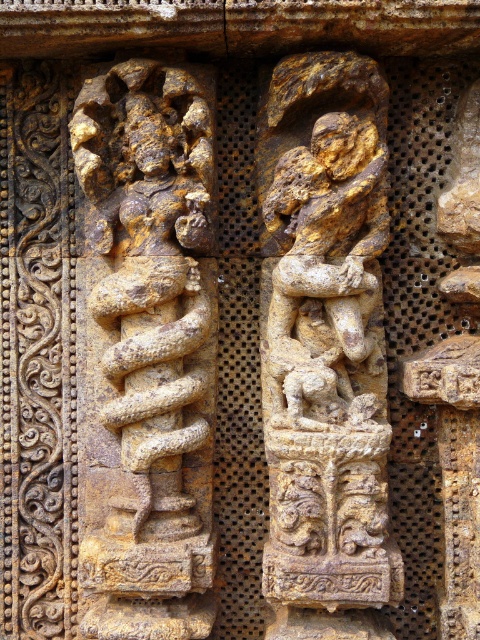
You are an archaeologist examining the stone relief. You notice the golden stone snake at left and the golden stone figure at center. Which one is located to the east side of the other?

The golden stone snake at left is positioned on the left side of golden stone figure at center, so the golden stone snake at left is east of the golden stone figure at center if the relief is oriented with left as east.

Based on the scene described, which object, the golden stone snake at left or the golden stone figure at center, occupies more space in the carving?

The golden stone snake at left is larger in size compared to the golden stone figure at center, so it occupies more space in the carving.